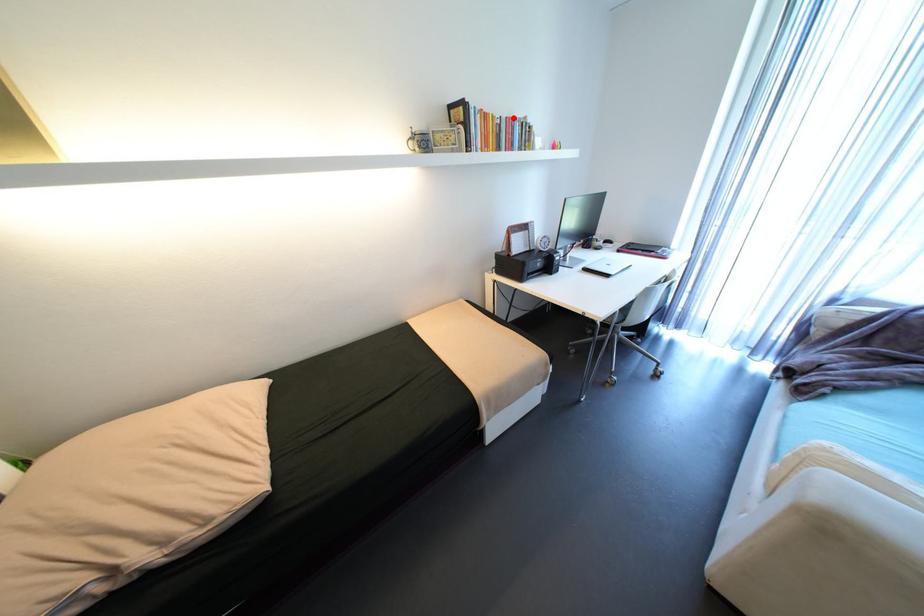
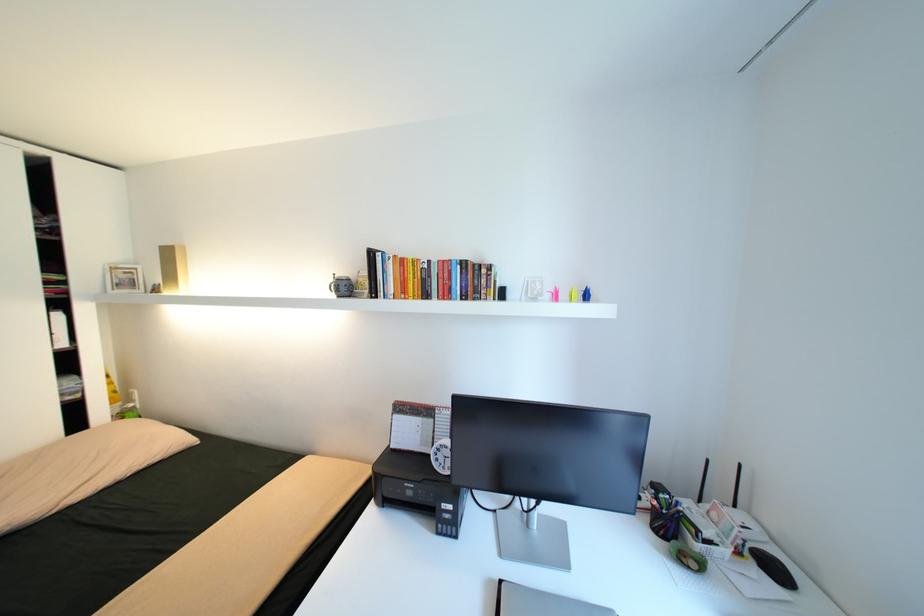
In the second image, find the point that corresponds to the highlighted location in the first image.

(445, 262)